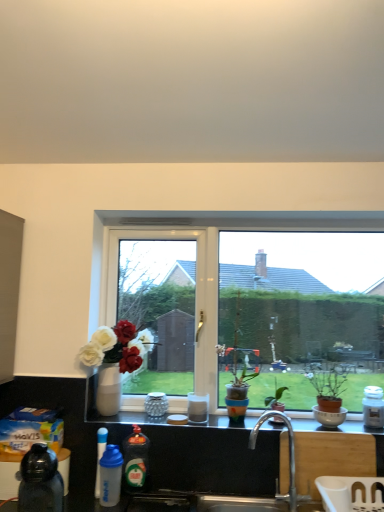
Question: From their relative heights in the image, would you say white glossy coffee cup at center, the second coffee cup viewed from the left, is taller or shorter than blue translucent bottle at lower left, the third bottle positioned from the front?

Choices:
 (A) tall
 (B) short

Answer: (B)

Question: From a real-world perspective, is white glossy coffee cup at center, which is the first coffee cup in front-to-back order, physically located above or below blue translucent bottle at lower left, acting as the third bottle starting from the back?

Choices:
 (A) below
 (B) above

Answer: (B)

Question: Considering the real-world distances, which object is closest to the silver metallic faucet at center?

Choices:
 (A) white glossy window at center
 (B) white matte jar at right, the 5th bottle from the front
 (C) white glossy coffee cup at center, placed as the 1th coffee cup when sorted from right to left
 (D) multicolored terracotta pot at center, the first houseplant when ordered from left to right
 (E) blue translucent bottle at lower left, which is the 2th bottle from left to right

Answer: (D)

Question: Which of these objects is positioned closest to the blue translucent bottle at lower left, the 3th bottle positioned from the left?

Choices:
 (A) white glossy window at center
 (B) green glossy dish soap at lower center, positioned as the 4th bottle in left-to-right order
 (C) porcelain textured cup at window, the 1th coffee cup when ordered from left to right
 (D) white glossy coffee cup at center, which is the first coffee cup in front-to-back order
 (E) blue translucent bottle at lower left, acting as the third bottle starting from the back

Answer: (E)